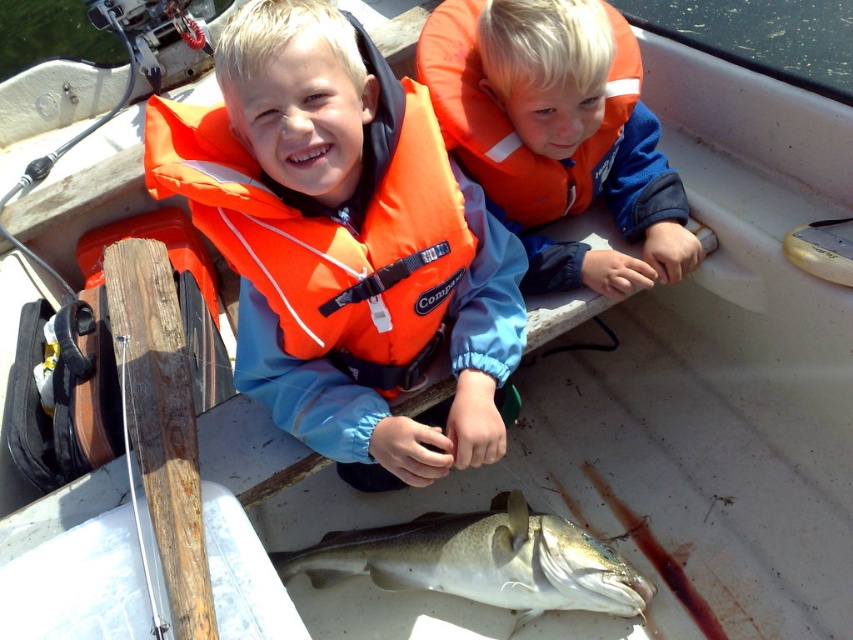
You are a photographer trying to capture a closeup of the speckled white fish at center without the orange life vest at center blocking the view. Can you tell me if the fish is smaller than the life vest?

The orange life vest at center is larger in size than the speckled white fish at center, so the fish is indeed smaller and might be easier to frame without obstruction.

You are a photographer trying to capture a closeup of the fish in the boat. The fish is located at point [310,97] and another object is at point [625,572]. Which point should you focus on to get the fish in focus?

You should focus on point [310,97] because it is closer to the camera and where the fish is located.